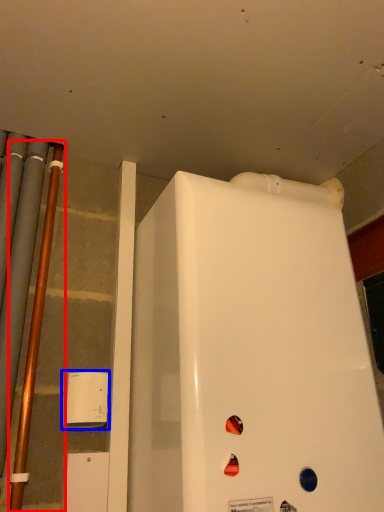
Question: Among these objects, which one is farthest to the camera, pipe (highlighted by a red box) or appliance (highlighted by a blue box)?

Choices:
 (A) pipe
 (B) appliance

Answer: (B)